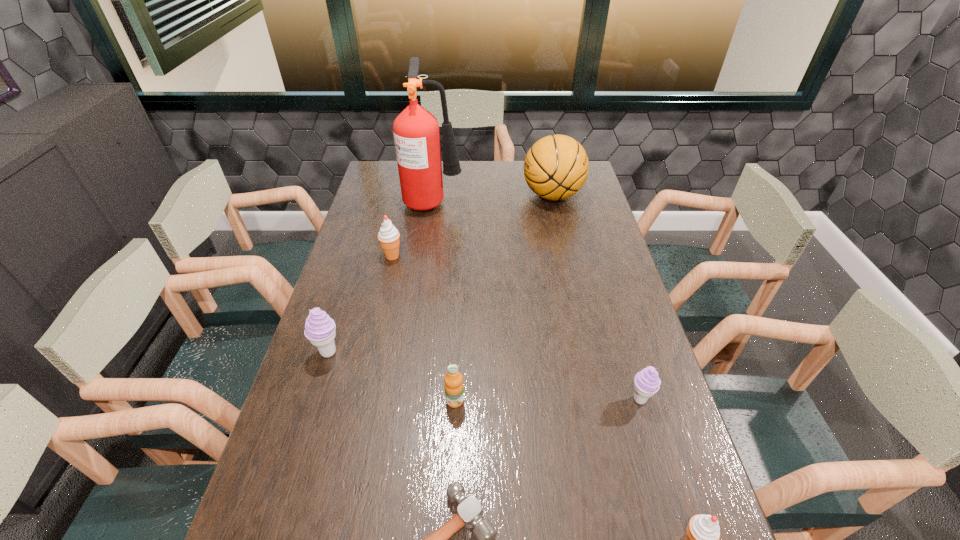
Identify the location of free spot that satisfies the following two spatial constraints: 1. on the surface of the basketball near the brand logo; 2. on the label of the orange juice. (597, 401).

Where is `free space in the image that satisfies the following two spatial constraints: 1. on the surface of the orange basketball near the brand logo; 2. on the left side of the smaller purple icecream`? Image resolution: width=960 pixels, height=540 pixels. free space in the image that satisfies the following two spatial constraints: 1. on the surface of the orange basketball near the brand logo; 2. on the left side of the smaller purple icecream is located at coordinates (597, 399).